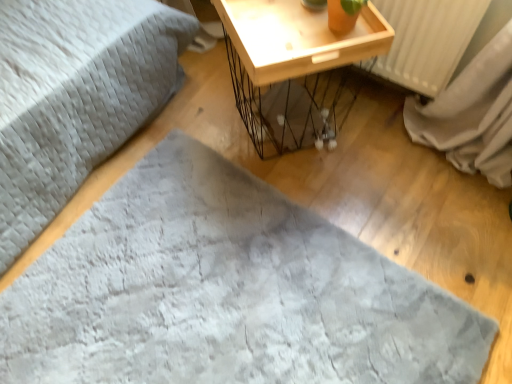
Question: From a real-world perspective, is gray soft fabric at center below wooden tray at upper right?

Choices:
 (A) no
 (B) yes

Answer: (B)

Question: Is gray soft fabric at center to the left of wooden tray at upper right from the viewer's perspective?

Choices:
 (A) no
 (B) yes

Answer: (B)

Question: Is gray soft fabric at center bigger than wooden tray at upper right?

Choices:
 (A) no
 (B) yes

Answer: (A)

Question: Does gray soft fabric at center come behind wooden tray at upper right?

Choices:
 (A) yes
 (B) no

Answer: (B)

Question: Considering the relative sizes of gray soft fabric at center and wooden tray at upper right in the image provided, is gray soft fabric at center smaller than wooden tray at upper right?

Choices:
 (A) yes
 (B) no

Answer: (A)

Question: Can you confirm if gray soft fabric at center is positioned to the right of wooden tray at upper right?

Choices:
 (A) yes
 (B) no

Answer: (B)

Question: Would you say wooden tray at upper right is a long distance from gray soft fabric at center?

Choices:
 (A) no
 (B) yes

Answer: (A)

Question: Are wooden tray at upper right and gray soft fabric at center making contact?

Choices:
 (A) no
 (B) yes

Answer: (A)

Question: Is wooden tray at upper right behind gray soft fabric at center?

Choices:
 (A) no
 (B) yes

Answer: (B)

Question: Is gray soft fabric at center surrounded by wooden tray at upper right?

Choices:
 (A) yes
 (B) no

Answer: (B)

Question: Is wooden tray at upper right to the left of gray soft fabric at center from the viewer's perspective?

Choices:
 (A) no
 (B) yes

Answer: (A)

Question: Considering the relative sizes of wooden tray at upper right and gray soft fabric at center in the image provided, is wooden tray at upper right shorter than gray soft fabric at center?

Choices:
 (A) no
 (B) yes

Answer: (A)

Question: Based on their positions, is gray soft fabric at center located to the left or right of wooden tray at upper right?

Choices:
 (A) right
 (B) left

Answer: (B)